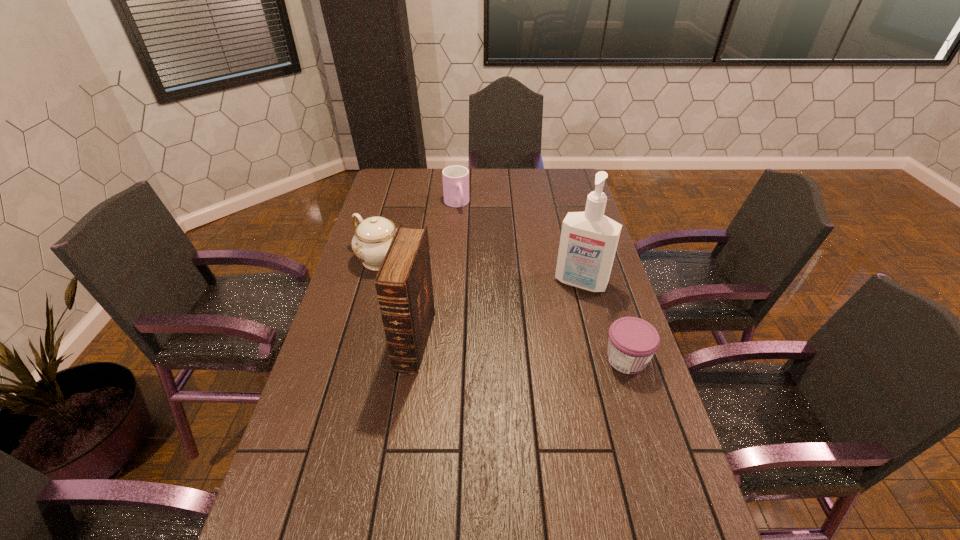
At what (x,y) coordinates should I click in order to perform the action: click on free area in between the second tallest object and the shortest object. Please return your answer as a coordinate pair (x, y). This screenshot has width=960, height=540. Looking at the image, I should click on (521, 350).

I want to click on vacant region between the Bible and the cup, so click(436, 273).

This screenshot has width=960, height=540. I want to click on empty space between the shortest object and the cleansing agent, so click(604, 321).

Identify which object is located as the third nearest to the fourth shortest object. Please provide its 2D coordinates. Your answer should be formatted as a tuple, i.e. [(x, y)], where the tuple contains the x and y coordinates of a point satisfying the conditions above.

[(633, 341)]

Locate an element on the screen. This screenshot has height=540, width=960. object identified as the closest to the leftmost object is located at coordinates (403, 283).

In order to click on vacant position in the image that satisfies the following two spatial constraints: 1. on the front side of the tallest object; 2. on the front label of the jam in this screenshot , I will do `click(601, 359)`.

You are a GUI agent. You are given a task and a screenshot of the screen. Output one action in this format:
    pyautogui.click(x=<x>, y=<y>)
    Task: Click on the blank space that satisfies the following two spatial constraints: 1. on the front side of the shortest object; 2. on the front label of the chinaware
    The image size is (960, 540).
    Given the screenshot: What is the action you would take?
    pyautogui.click(x=353, y=359)